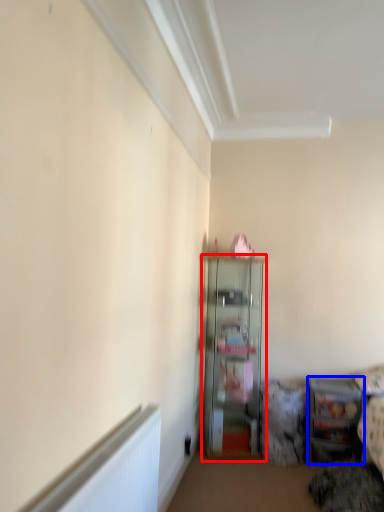
Question: Which point is further to the camera, shelf (highlighted by a red box) or shelf (highlighted by a blue box)?

Choices:
 (A) shelf
 (B) shelf

Answer: (A)